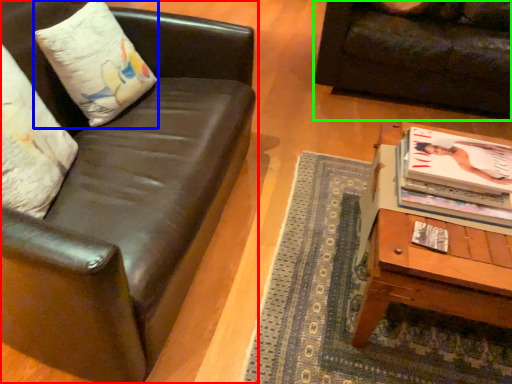
Question: Based on their relative distances, which object is nearer to studio couch (highlighted by a red box)? Choose from pillow (highlighted by a blue box) and studio couch (highlighted by a green box).

Choices:
 (A) pillow
 (B) studio couch

Answer: (A)